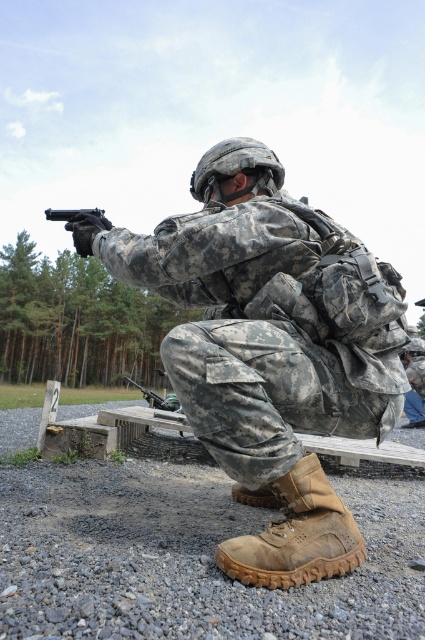
The width and height of the screenshot is (425, 640). I want to click on camouflage fabric uniform at center, so click(272, 349).

The width and height of the screenshot is (425, 640). What do you see at coordinates (272, 349) in the screenshot? I see `camouflage fabric uniform at center` at bounding box center [272, 349].

Looking at this image, who is more forward, (263, 554) or (141, 387)?

Positioned in front is point (263, 554).

Identify the location of camouflage fabric uniform at center. This screenshot has height=640, width=425. [272, 349].

Does point (96, 216) come behind point (158, 401)?

No, (96, 216) is closer to viewer.

Can you confirm if matte black handgun at upper center is positioned below matte black shotgun at lower center?

Actually, matte black handgun at upper center is above matte black shotgun at lower center.

Which is in front, point (59, 212) or point (166, 406)?

Positioned in front is point (59, 212).

The image size is (425, 640). Find the location of `matte black handgun at upper center`. matte black handgun at upper center is located at coordinates (81, 225).

Which is behind, point (189, 294) or point (300, 579)?

Positioned behind is point (189, 294).

Find the location of a particular element. The height and width of the screenshot is (640, 425). camouflage fabric uniform at center is located at coordinates (272, 349).